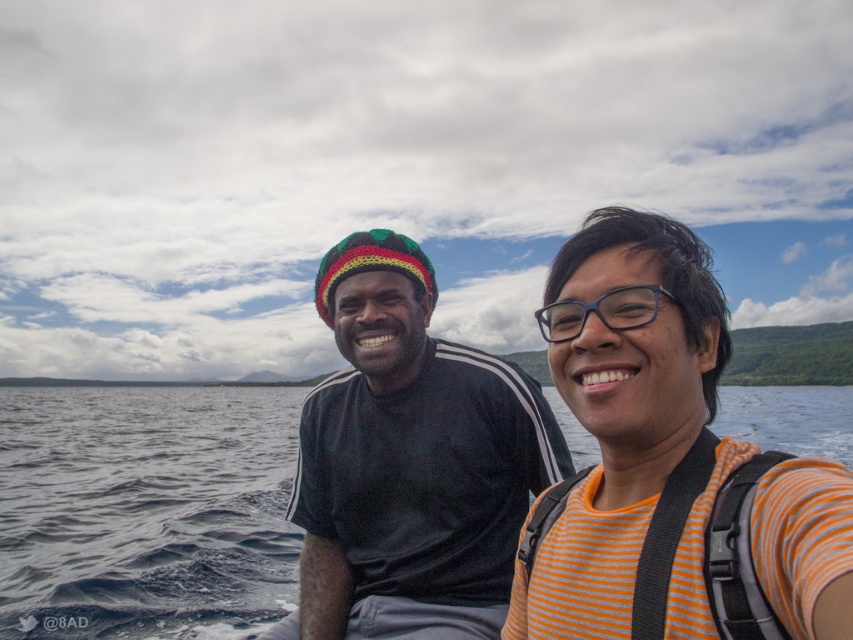
You are on a boat and want to take a photo of the dark blue water at center and the transparent plastic glasses at center. Which object should you focus on first if you want to capture both in the same frame without moving the camera?

The transparent plastic glasses at center should be focused on first because the dark blue water at center is positioned to its right, so adjusting focus to the glasses ensures both are in frame without needing to reposition the camera.

You are on a boat and want to take a photo of the orange striped shirt at right and the dark blue water at center. Which object should you focus on first if you want to capture both in the same frame?

The orange striped shirt at right has a smaller size compared to dark blue water at center, so you should focus on the dark blue water at center first to ensure both are in focus.

Based on the photo, you are standing at the origin point of the coordinate system. You see the point at coordinates point (x=664, y=460). What object is located at this point?

The point at coordinates (x=664, y=460) corresponds to the orange striped shirt at right.